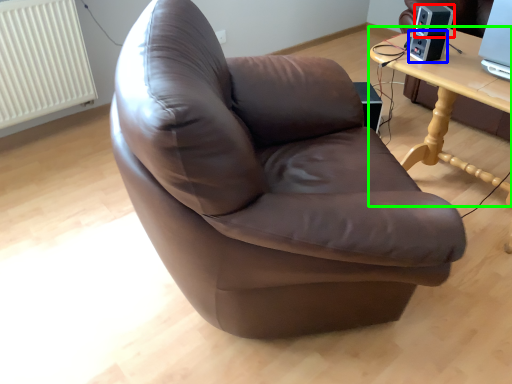
Question: Considering the real-world distances, which object is farthest from speaker (highlighted by a red box)? speaker (highlighted by a blue box) or table (highlighted by a green box)?

Choices:
 (A) speaker
 (B) table

Answer: (B)